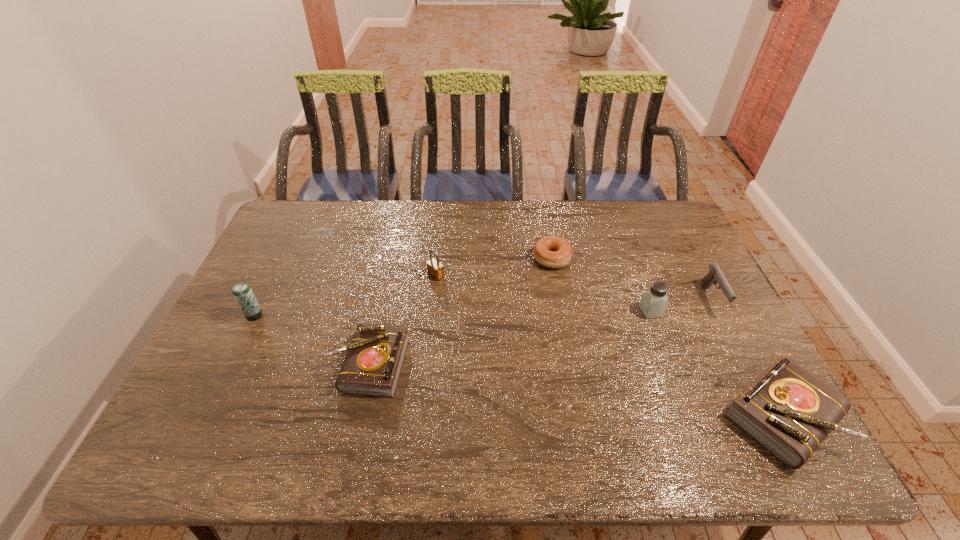
Locate an element on the screen. Image resolution: width=960 pixels, height=540 pixels. free space located 0.050m on the front of the left diary is located at coordinates (356, 417).

Identify the location of vacant region located 0.300m on the back of the third shortest object. (712, 286).

Find the location of `vacant point located 0.100m on the right of the fourth object from left to right`. vacant point located 0.100m on the right of the fourth object from left to right is located at coordinates (601, 259).

You are a GUI agent. You are given a task and a screenshot of the screen. Output one action in this format:
    pyautogui.click(x=<x>, y=<y>)
    Task: Click on the free space located 0.270m on the front of the beer can
    This screenshot has width=960, height=540.
    Given the screenshot: What is the action you would take?
    pyautogui.click(x=209, y=408)

The width and height of the screenshot is (960, 540). In order to click on vacant space located on the left of the saltshaker in this screenshot , I will do `click(619, 312)`.

Find the location of a particular element. free space located on the right of the padlock is located at coordinates (527, 275).

The image size is (960, 540). What are the coordinates of `free region located at the barrel of the pistol` in the screenshot? It's located at (764, 401).

Image resolution: width=960 pixels, height=540 pixels. Find the location of `object that is at the left edge`. object that is at the left edge is located at coordinates (242, 292).

At what (x,y) coordinates should I click in order to perform the action: click on diary that is at the right edge. Please return your answer as a coordinate pair (x, y). The image size is (960, 540). Looking at the image, I should click on (789, 411).

The image size is (960, 540). Find the location of `pistol that is at the right edge`. pistol that is at the right edge is located at coordinates (715, 275).